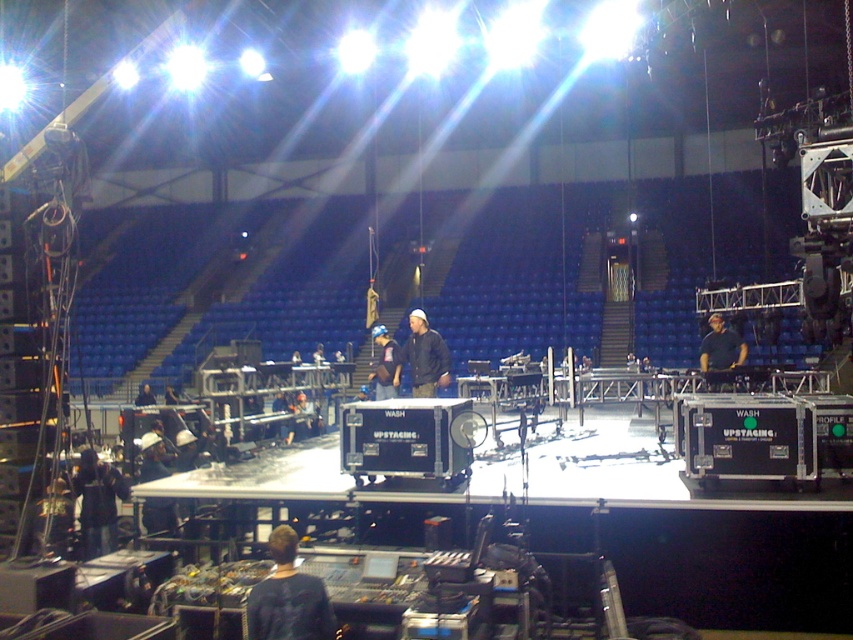
Looking at this image, is dark blue jacket at center below dark blue shirt at center?

Yes, dark blue jacket at center is below dark blue shirt at center.

Who is positioned more to the left, dark blue jacket at center or dark blue shirt at center?

From the viewer's perspective, dark blue jacket at center appears more on the left side.

You are a GUI agent. You are given a task and a screenshot of the screen. Output one action in this format:
    pyautogui.click(x=<x>, y=<y>)
    Task: Click on the dark blue jacket at center
    
    Given the screenshot: What is the action you would take?
    pyautogui.click(x=422, y=356)